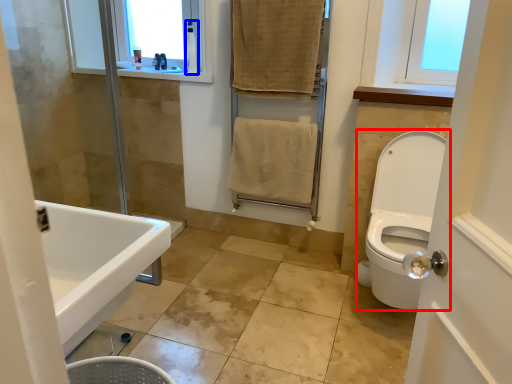
Question: Which of the following is the closest to the observer, toilet (highlighted by a red box) or toiletry (highlighted by a blue box)?

Choices:
 (A) toilet
 (B) toiletry

Answer: (A)